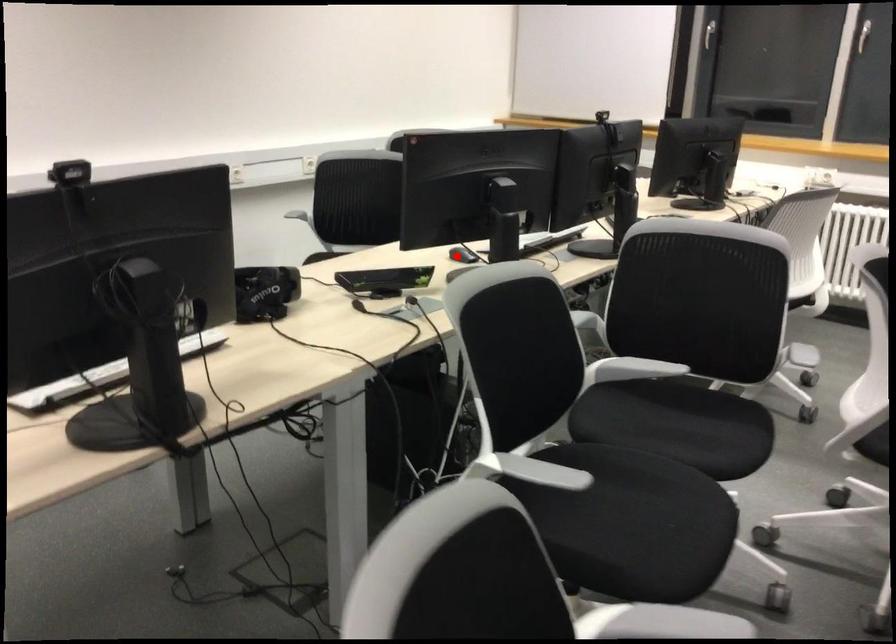
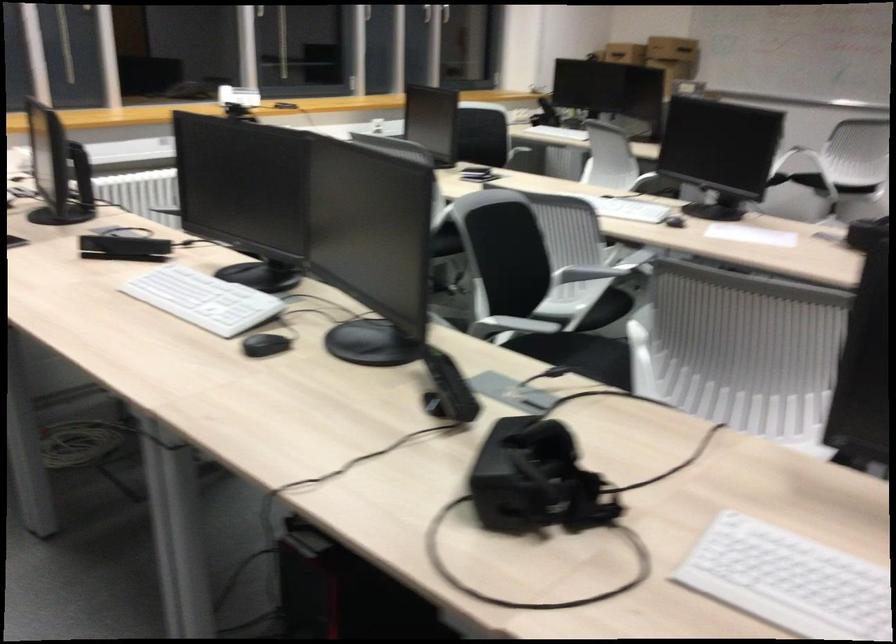
Where in the second image is the point corresponding to the highlighted location from the first image?

(264, 345)